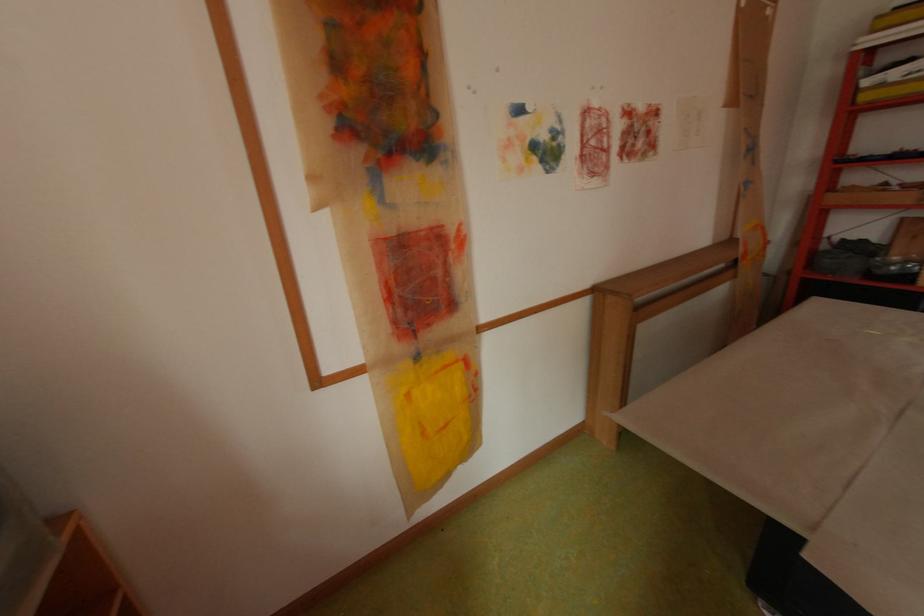
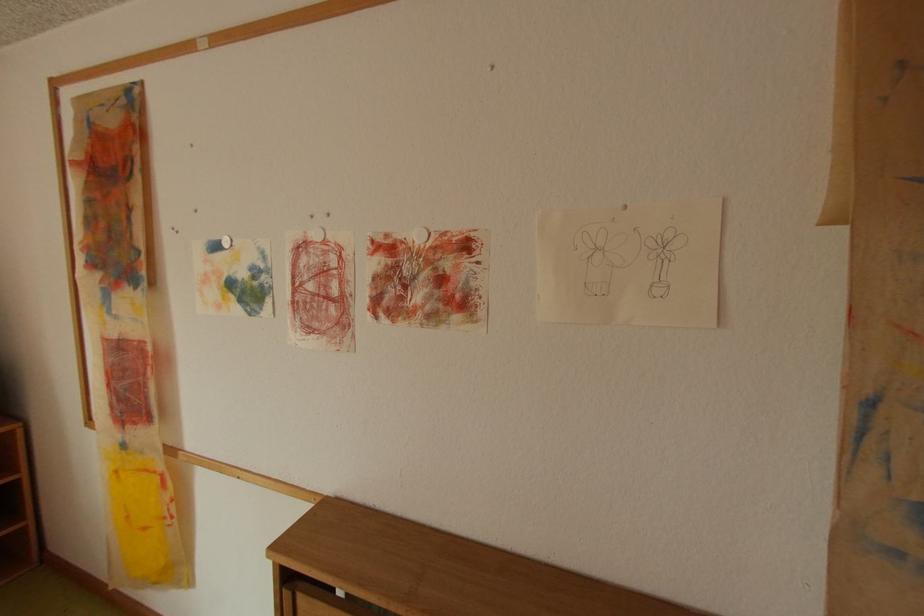
Where in the second image is the point corresponding to pixel 647 153 from the first image?

(420, 313)